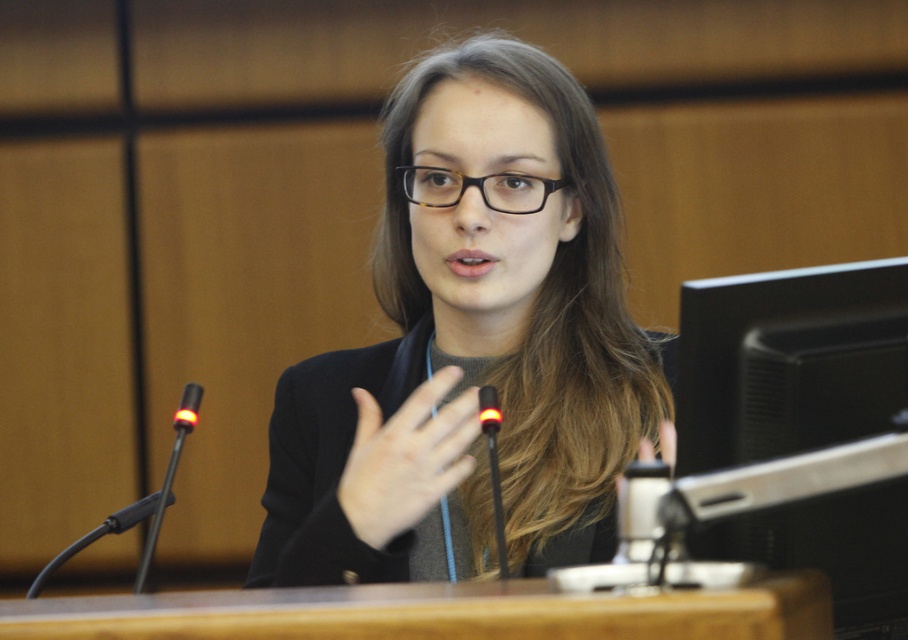
Question: Which point is farther from the camera taking this photo?

Choices:
 (A) (421, 204)
 (B) (754, 385)
 (C) (331, 413)

Answer: (C)

Question: Is smooth skin hand at center thinner than black plastic microphone at center?

Choices:
 (A) yes
 (B) no

Answer: (B)

Question: Can you confirm if black matte jacket at center is thinner than black tortoiseshell glasses at center?

Choices:
 (A) yes
 (B) no

Answer: (B)

Question: Which of the following is the farthest from the observer?

Choices:
 (A) black tortoiseshell glasses at center
 (B) black plastic microphone at left
 (C) black plastic microphone at center
 (D) smooth skin hand at center

Answer: (A)

Question: Which point is farther to the camera?

Choices:
 (A) black glossy monitor at right
 (B) black plastic microphone at left
 (C) smooth skin hand at center
 (D) brown wood table at center

Answer: (B)

Question: Can you confirm if black matte jacket at center is wider than black plastic microphone at left?

Choices:
 (A) yes
 (B) no

Answer: (A)